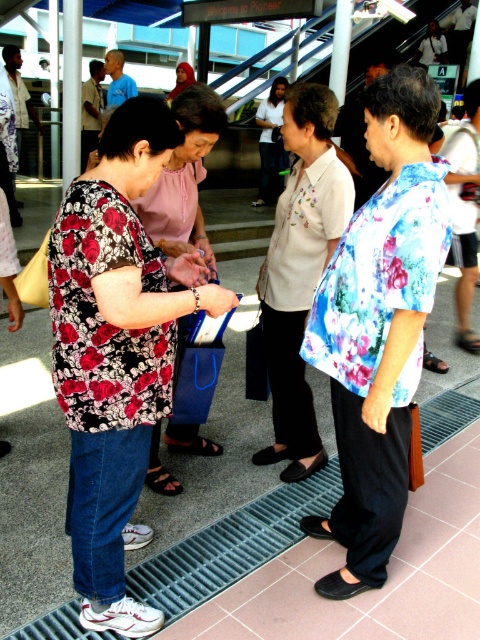
Based on the photo, you are standing at the train station and want to know which of the two points, point (x=117, y=410) or point (x=168, y=177), is closer to you. Based on the scene description, can you determine which point is nearer?

Point (x=117, y=410) is closer to the viewer than point (x=168, y=177).